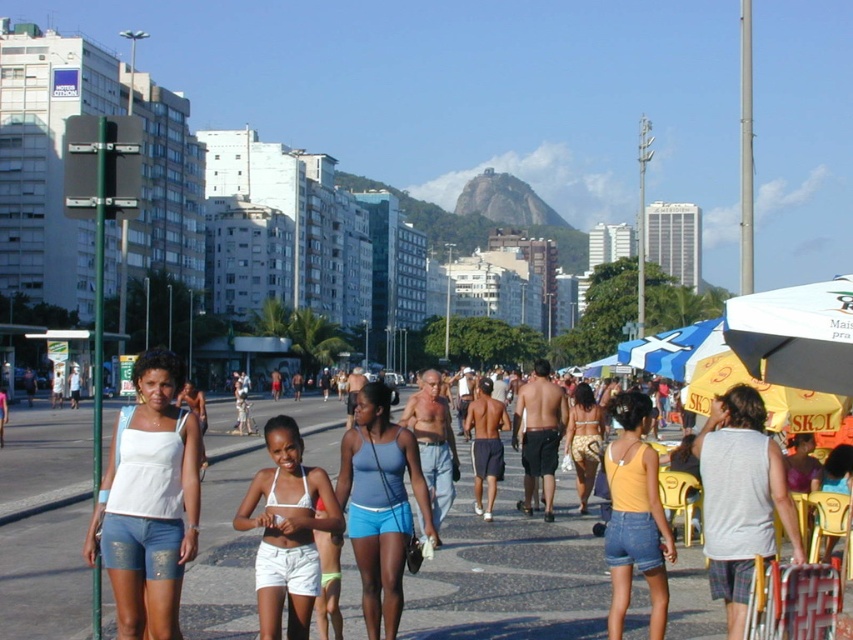
Question: Can you confirm if matte blue shorts at center is positioned to the left of white cotton tank top at center?

Choices:
 (A) yes
 (B) no

Answer: (B)

Question: Can you confirm if white matte shorts at center is positioned above white cotton tank top at center?

Choices:
 (A) no
 (B) yes

Answer: (B)

Question: Is yellow denim shorts at center thinner than patterned fabric bikini at center?

Choices:
 (A) yes
 (B) no

Answer: (A)

Question: Which of the following is the farthest from the observer?

Choices:
 (A) white matte shorts at center
 (B) patterned fabric bikini at center

Answer: (B)

Question: Which point is closer to the camera?

Choices:
 (A) (273, 548)
 (B) (599, 422)
 (C) (369, 532)

Answer: (A)

Question: Which of these objects is positioned closest to the white cotton tank top at center?

Choices:
 (A) patterned fabric bikini at center
 (B) matte blue shorts at center
 (C) yellow denim shorts at center
 (D) white matte shorts at center

Answer: (D)